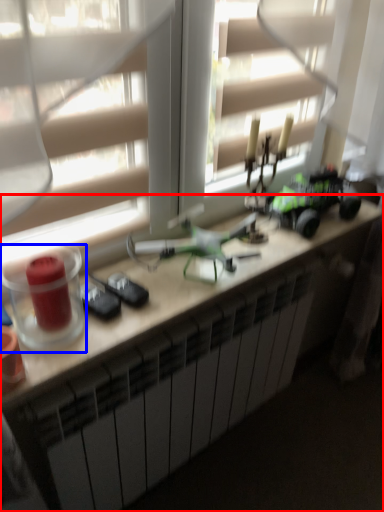
Question: Which point is further to the camera, desk (highlighted by a red box) or candle holder (highlighted by a blue box)?

Choices:
 (A) desk
 (B) candle holder

Answer: (A)